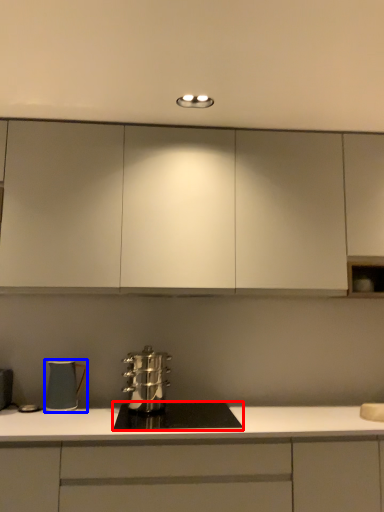
Question: Which object appears closest to the camera in this image, home appliance (highlighted by a red box) or kitchen appliance (highlighted by a blue box)?

Choices:
 (A) home appliance
 (B) kitchen appliance

Answer: (A)